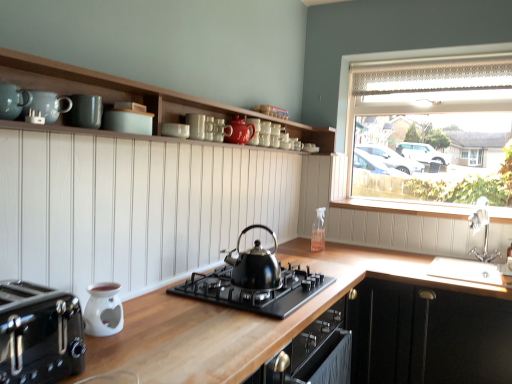
Question: From a real-world perspective, is clear glass spray bottle at upper right positioned above or below black matte gas stove at center?

Choices:
 (A) below
 (B) above

Answer: (B)

Question: Visually, is clear glass spray bottle at upper right positioned to the left or to the right of black matte gas stove at center?

Choices:
 (A) left
 (B) right

Answer: (B)

Question: Which of these objects is positioned closest to the black polished kettle at center?

Choices:
 (A) black matte cabinet at lower right, which appears as the 1th cabinetry when viewed from the right
 (B) teal matte mugs at upper center, the 1th teal positioned from the back
 (C) clear glass window at upper right
 (D) wooden at lower center
 (E) white ceramic sink at right

Answer: (D)

Question: Which object is the farthest from the matte ceramic teapot at upper center?

Choices:
 (A) clear glass window at upper right
 (B) matte gray mug at upper center, which is the first mug from left to right
 (C) black matte gas stove at center
 (D) wooden at lower center
 (E) wooden shelves at upper center, which is the 2th cabinetry in bottom-to-top order

Answer: (A)